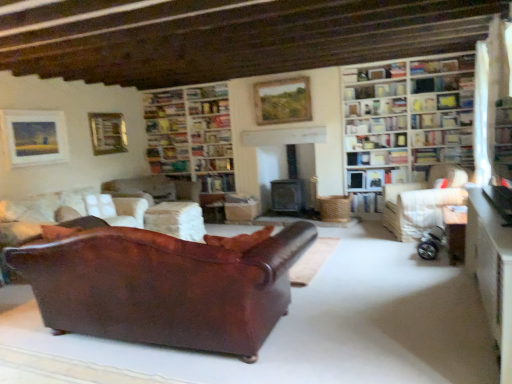
I want to click on blank area to the left of silver metallic baby carriage at lower right, so click(388, 254).